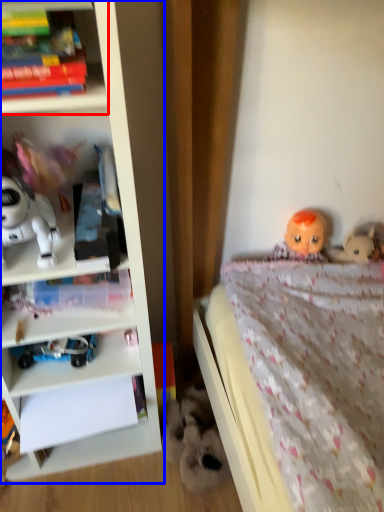
Question: Which object appears closest to the camera in this image, shelf (highlighted by a red box) or bookcase (highlighted by a blue box)?

Choices:
 (A) shelf
 (B) bookcase

Answer: (B)